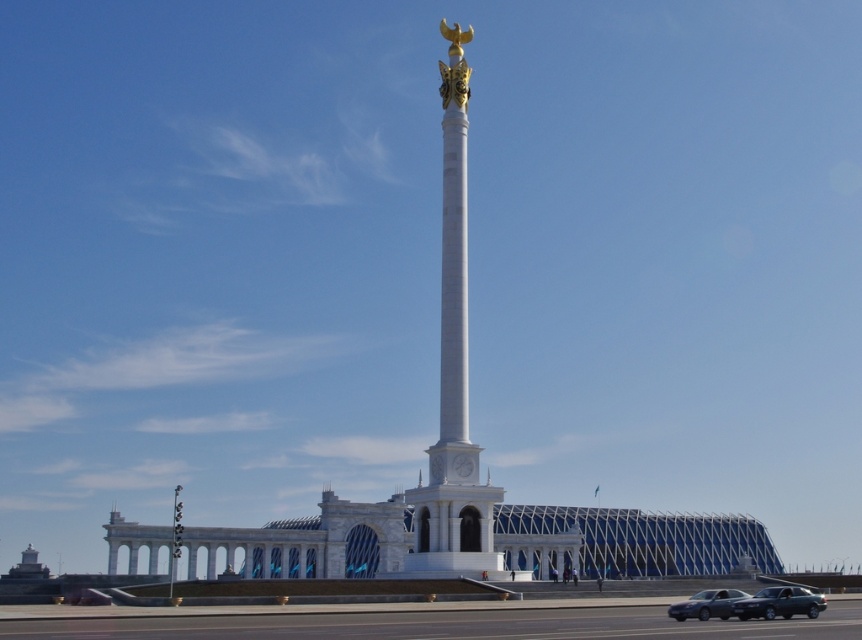
Is metallic gray sedan at lower right to the left of silver metallic sedan at lower right from the viewer's perspective?

Incorrect, metallic gray sedan at lower right is not on the left side of silver metallic sedan at lower right.

This screenshot has height=640, width=862. What do you see at coordinates (779, 604) in the screenshot?
I see `metallic gray sedan at lower right` at bounding box center [779, 604].

Locate an element on the screen. metallic gray sedan at lower right is located at coordinates (779, 604).

Which of these two, white marble column at center or metallic gray sedan at lower right, stands shorter?

With less height is metallic gray sedan at lower right.

From the picture: Is white marble column at center further to the viewer compared to metallic gray sedan at lower right?

Yes, it is behind metallic gray sedan at lower right.

I want to click on white marble column at center, so click(x=453, y=372).

Does white marble column at center have a lesser height compared to silver metallic sedan at lower right?

No.

Based on the photo, can you confirm if white marble column at center is bigger than silver metallic sedan at lower right?

Yes.

From the picture: Who is more forward, (454, 547) or (721, 605)?

Point (721, 605) is more forward.

What are the coordinates of `white marble column at center` in the screenshot? It's located at (453, 372).